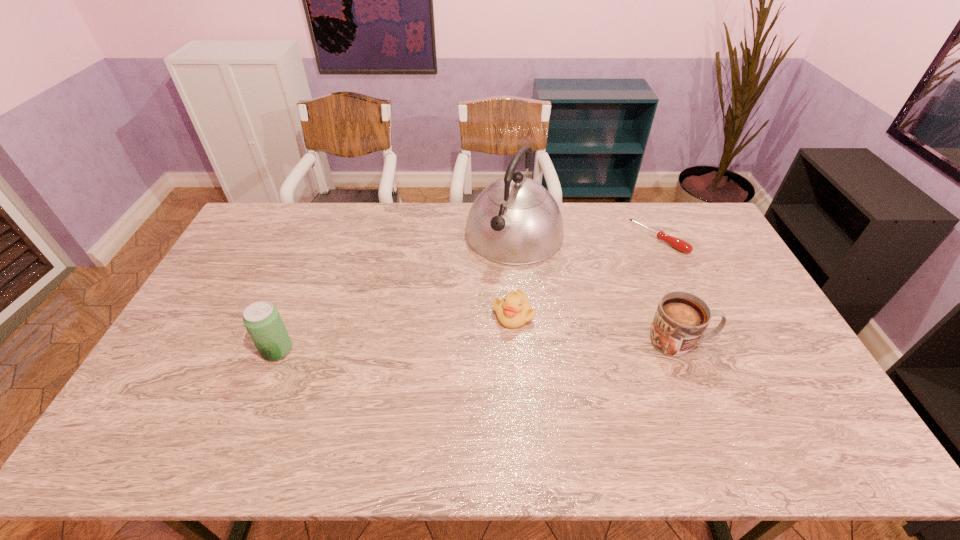
Image resolution: width=960 pixels, height=540 pixels. Find the location of `vacant space at the far edge`. vacant space at the far edge is located at coordinates tap(362, 202).

In the image, there is a desktop. Identify the location of vacant space at the near edge. (590, 391).

Find the location of a particular element. The height and width of the screenshot is (540, 960). vacant space at the left edge of the desktop is located at coordinates (247, 261).

The image size is (960, 540). Identify the location of blank space at the right edge of the desktop. (761, 330).

Image resolution: width=960 pixels, height=540 pixels. In order to click on free spot at the far left corner of the desktop in this screenshot , I will do `click(290, 227)`.

At what (x,y) coordinates should I click in order to perform the action: click on free space at the far right corner. Please return your answer as a coordinate pair (x, y). Image resolution: width=960 pixels, height=540 pixels. Looking at the image, I should click on (683, 203).

Locate an element on the screen. This screenshot has height=540, width=960. free space between the screwdriver and the kettle is located at coordinates (587, 236).

The height and width of the screenshot is (540, 960). Find the location of `free space between the duckling and the leftmost object`. free space between the duckling and the leftmost object is located at coordinates (396, 332).

The height and width of the screenshot is (540, 960). Find the location of `empty space between the mug and the shortest object`. empty space between the mug and the shortest object is located at coordinates [669, 291].

In order to click on free space between the second shortest object and the tallest object in this screenshot , I will do `click(514, 274)`.